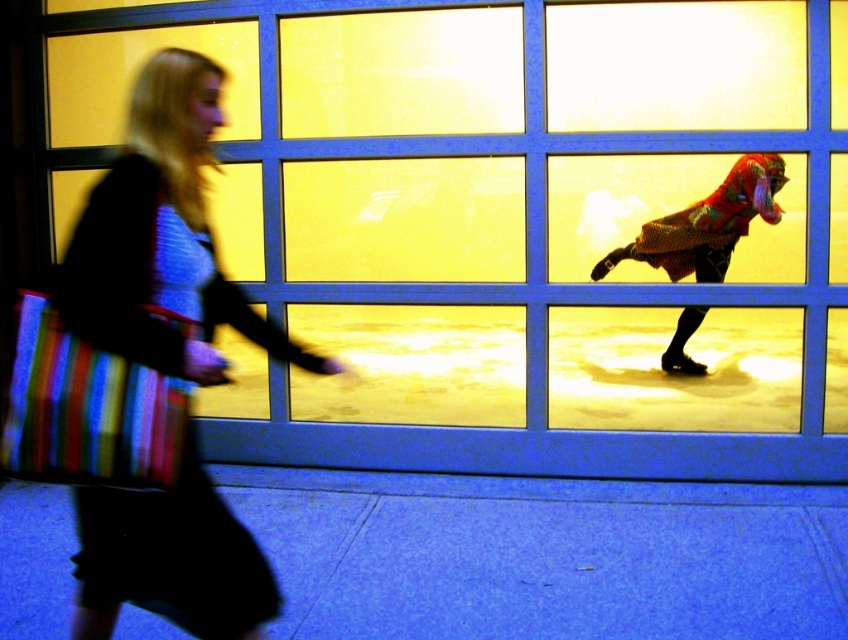
Measure the distance between point (791, 477) and camera.

Point (791, 477) is 3.94 meters from camera.

Who is more distant from viewer, [738,460] or [400,515]?

The point [738,460] is behind.

Does point (232, 390) lie in front of point (155, 625)?

That is False.

Identify the location of yellow glass window at center. (500, 224).

Does blue smooth pavement at lower center have a greater width compared to striped fabric bag at left?

Yes, blue smooth pavement at lower center is wider than striped fabric bag at left.

Locate an element on the screen. Image resolution: width=848 pixels, height=640 pixels. blue smooth pavement at lower center is located at coordinates (544, 556).

Locate an element on the screen. The image size is (848, 640). blue smooth pavement at lower center is located at coordinates (544, 556).

Where is `striped fabric bag at left`? This screenshot has width=848, height=640. striped fabric bag at left is located at coordinates (162, 236).

Between striped fabric bag at left and shiny metallic figure at right, which one has less height?

With less height is shiny metallic figure at right.

Is point (87, 600) farther from camera compared to point (734, 237)?

No, (87, 600) is in front of (734, 237).

Where is `striped fabric bag at left`? This screenshot has height=640, width=848. striped fabric bag at left is located at coordinates (162, 236).